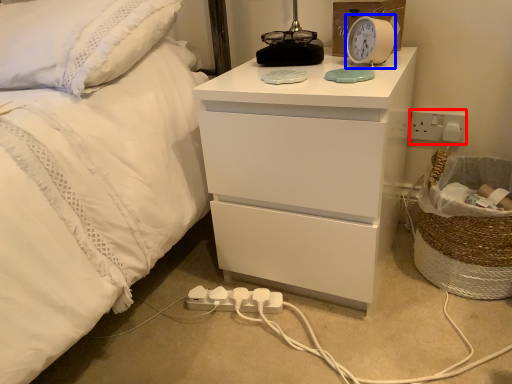
Question: Which object appears farthest to the camera in this image, electric outlet (highlighted by a red box) or alarm clock (highlighted by a blue box)?

Choices:
 (A) electric outlet
 (B) alarm clock

Answer: (A)